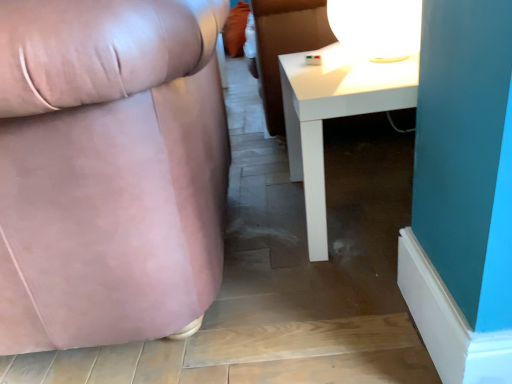
Question: Is white glossy table at lower right looking in the opposite direction of matte pink fabric chair at left?

Choices:
 (A) yes
 (B) no

Answer: (B)

Question: Can you confirm if white glossy table at lower right is taller than matte pink fabric chair at left?

Choices:
 (A) yes
 (B) no

Answer: (B)

Question: Is white glossy table at lower right positioned before matte pink fabric chair at left?

Choices:
 (A) no
 (B) yes

Answer: (A)

Question: Is white glossy table at lower right beside matte pink fabric chair at left?

Choices:
 (A) yes
 (B) no

Answer: (B)

Question: Is white glossy table at lower right far away from matte pink fabric chair at left?

Choices:
 (A) yes
 (B) no

Answer: (B)

Question: Considering the relative sizes of white glossy table at lower right and matte pink fabric chair at left in the image provided, is white glossy table at lower right shorter than matte pink fabric chair at left?

Choices:
 (A) yes
 (B) no

Answer: (A)

Question: Does white glossy table lamp at upper right have a larger size compared to white glossy table at lower right?

Choices:
 (A) yes
 (B) no

Answer: (B)

Question: Considering the relative sizes of white glossy table lamp at upper right and white glossy table at lower right in the image provided, is white glossy table lamp at upper right wider than white glossy table at lower right?

Choices:
 (A) yes
 (B) no

Answer: (B)

Question: Is white glossy table lamp at upper right looking in the opposite direction of white glossy table at lower right?

Choices:
 (A) no
 (B) yes

Answer: (A)

Question: Is there a large distance between white glossy table lamp at upper right and white glossy table at lower right?

Choices:
 (A) no
 (B) yes

Answer: (A)

Question: Is white glossy table lamp at upper right smaller than white glossy table at lower right?

Choices:
 (A) no
 (B) yes

Answer: (B)

Question: Can you confirm if white glossy table lamp at upper right is shorter than white glossy table at lower right?

Choices:
 (A) yes
 (B) no

Answer: (A)

Question: From a real-world perspective, is matte pink fabric chair at left physically below white glossy table at lower right?

Choices:
 (A) no
 (B) yes

Answer: (A)